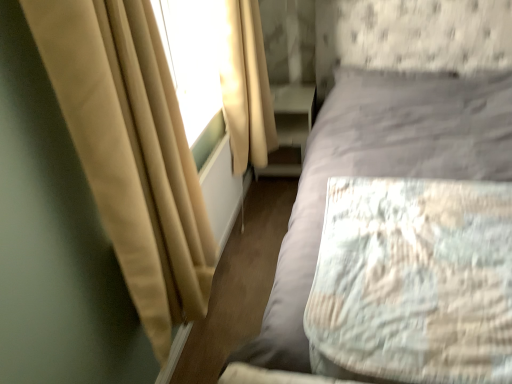
Question: Is beige fabric curtain at left, which appears as the first curtain when viewed from the front, not near textured gray bed at center?

Choices:
 (A) yes
 (B) no

Answer: (B)

Question: Is beige fabric curtain at left, which appears as the first curtain when viewed from the front, surrounding textured gray bed at center?

Choices:
 (A) yes
 (B) no

Answer: (B)

Question: From a real-world perspective, is beige fabric curtain at left, placed as the 2th curtain when sorted from back to front, located higher than textured gray bed at center?

Choices:
 (A) yes
 (B) no

Answer: (A)

Question: From the image's perspective, would you say beige fabric curtain at left, which appears as the first curtain when viewed from the front, is shown under textured gray bed at center?

Choices:
 (A) yes
 (B) no

Answer: (A)

Question: Is beige fabric curtain at left, placed as the 2th curtain when sorted from back to front, taller than textured gray bed at center?

Choices:
 (A) no
 (B) yes

Answer: (A)

Question: From a real-world perspective, is beige fabric curtain at left, placed as the 2th curtain when sorted from back to front, located beneath textured gray bed at center?

Choices:
 (A) yes
 (B) no

Answer: (B)

Question: From a real-world perspective, does beige fabric curtain at left, which appears as the first curtain when viewed from the front, sit lower than beige fabric curtain at upper left, arranged as the second curtain when viewed from the front?

Choices:
 (A) no
 (B) yes

Answer: (A)

Question: Is beige fabric curtain at left, placed as the 2th curtain when sorted from back to front, wider than beige fabric curtain at upper left, arranged as the second curtain when viewed from the front?

Choices:
 (A) no
 (B) yes

Answer: (A)

Question: Is beige fabric curtain at left, which appears as the first curtain when viewed from the front, outside beige fabric curtain at upper left, the 1th curtain when ordered from back to front?

Choices:
 (A) yes
 (B) no

Answer: (A)

Question: Does beige fabric curtain at left, placed as the 2th curtain when sorted from back to front, have a greater height compared to beige fabric curtain at upper left, arranged as the second curtain when viewed from the front?

Choices:
 (A) yes
 (B) no

Answer: (A)

Question: Considering the relative positions of beige fabric curtain at left, placed as the 2th curtain when sorted from back to front, and beige fabric curtain at upper left, arranged as the second curtain when viewed from the front, in the image provided, is beige fabric curtain at left, placed as the 2th curtain when sorted from back to front, to the right of beige fabric curtain at upper left, arranged as the second curtain when viewed from the front, from the viewer's perspective?

Choices:
 (A) yes
 (B) no

Answer: (B)

Question: Is beige fabric curtain at left, placed as the 2th curtain when sorted from back to front, oriented away from beige fabric curtain at upper left, arranged as the second curtain when viewed from the front?

Choices:
 (A) yes
 (B) no

Answer: (B)

Question: Considering the relative sizes of matte white dresser at lower center and textured gray bed at center in the image provided, is matte white dresser at lower center wider than textured gray bed at center?

Choices:
 (A) no
 (B) yes

Answer: (A)